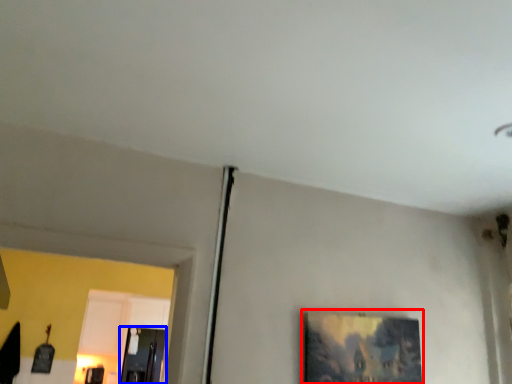
Question: Which of the following is the farthest to the observer, picture frame (highlighted by a red box) or glass door (highlighted by a blue box)?

Choices:
 (A) picture frame
 (B) glass door

Answer: (B)